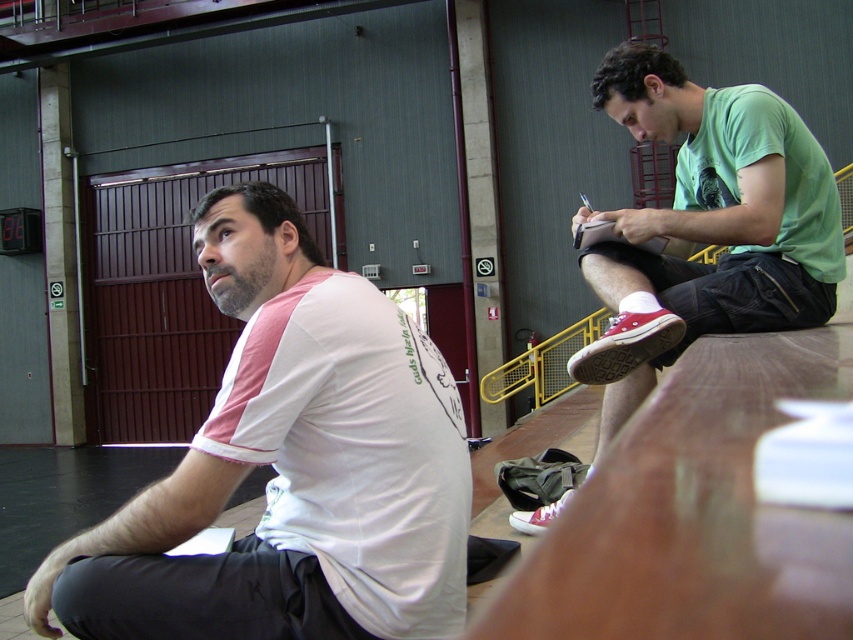
What do you see at coordinates (705, 227) in the screenshot? This screenshot has height=640, width=853. I see `green matte shirt at upper right` at bounding box center [705, 227].

Based on the photo, which is above, green matte shirt at upper right or matte white shoe at lower center?

green matte shirt at upper right is above.

Measure the distance between green matte shirt at upper right and camera.

green matte shirt at upper right and camera are 7.18 feet apart from each other.

Identify the location of green matte shirt at upper right. (705, 227).

At what (x,y) coordinates should I click in order to perform the action: click on white fabric shirt at left. Please return your answer as a coordinate pair (x, y). This screenshot has height=640, width=853. Looking at the image, I should click on (289, 467).

Is white fabric shirt at left further to camera compared to matte white shoe at lower center?

No, it is not.

You are a GUI agent. You are given a task and a screenshot of the screen. Output one action in this format:
    pyautogui.click(x=<x>, y=<y>)
    Task: Click on the white fabric shirt at left
    The height and width of the screenshot is (640, 853).
    Given the screenshot: What is the action you would take?
    point(289,467)

What do you see at coordinates (705, 227) in the screenshot? I see `green matte shirt at upper right` at bounding box center [705, 227].

Can you confirm if green matte shirt at upper right is taller than red canvas shoe at lower right?

Indeed, green matte shirt at upper right has a greater height compared to red canvas shoe at lower right.

What are the coordinates of `green matte shirt at upper right` in the screenshot? It's located at (705, 227).

At what (x,y) coordinates should I click in order to perform the action: click on green matte shirt at upper right. Please return your answer as a coordinate pair (x, y). Looking at the image, I should click on (705, 227).